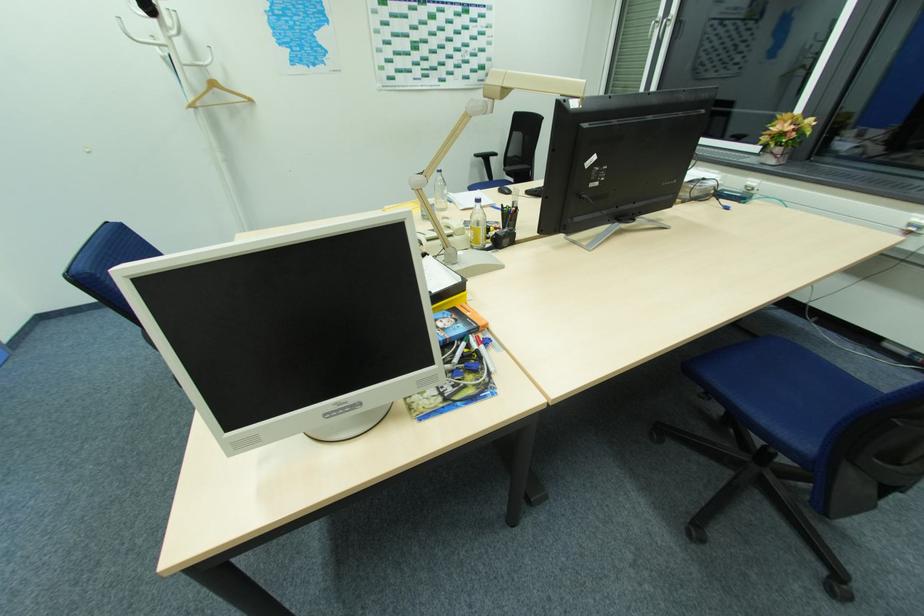
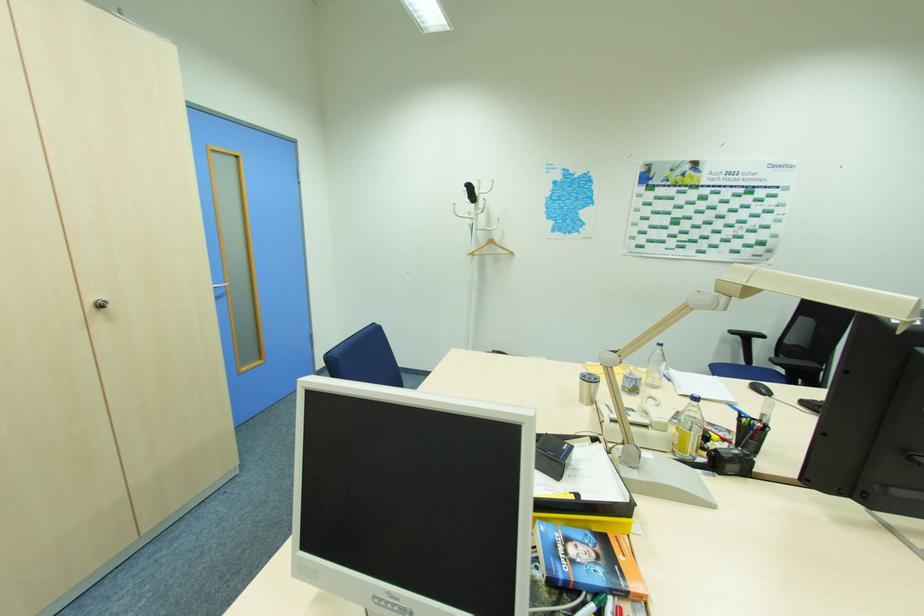
Find the pixel in the second image that matches the point at 442,174 in the first image.

(663, 347)